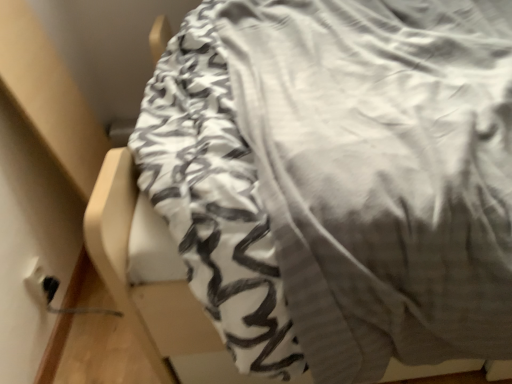
I want to click on white plastic electric outlet at lower left, so click(41, 284).

The image size is (512, 384). What do you see at coordinates (41, 284) in the screenshot?
I see `white plastic electric outlet at lower left` at bounding box center [41, 284].

Locate an element on the screen. white plastic electric outlet at lower left is located at coordinates (41, 284).